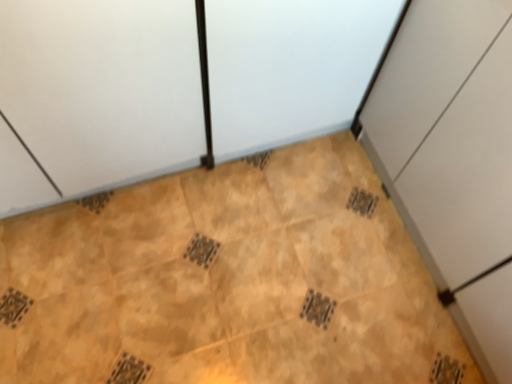
Question: Does point (471, 170) appear closer or farther from the camera than point (193, 266)?

Choices:
 (A) farther
 (B) closer

Answer: (B)

Question: Looking at the image, does white matte cabinet at right seem bigger or smaller compared to brown textured tile at center?

Choices:
 (A) small
 (B) big

Answer: (B)

Question: From the image's perspective, is white matte cabinet at right above or below brown textured tile at center?

Choices:
 (A) below
 (B) above

Answer: (B)

Question: Is brown textured tile at center wider or thinner than white matte cabinet at right?

Choices:
 (A) wide
 (B) thin

Answer: (A)

Question: Relative to white matte cabinet at right, is brown textured tile at center in front or behind?

Choices:
 (A) front
 (B) behind

Answer: (B)

Question: Is brown textured tile at center taller or shorter than white matte cabinet at right?

Choices:
 (A) tall
 (B) short

Answer: (B)

Question: Is point (243, 319) closer or farther from the camera than point (488, 110)?

Choices:
 (A) closer
 (B) farther

Answer: (B)